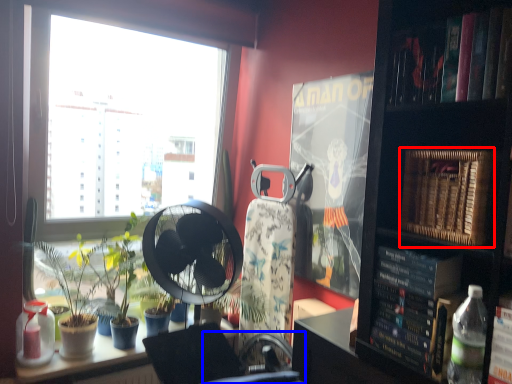
Question: Which object is further to the camera taking this photo, paperback book (highlighted by a red box) or swivel chair (highlighted by a blue box)?

Choices:
 (A) paperback book
 (B) swivel chair

Answer: (A)